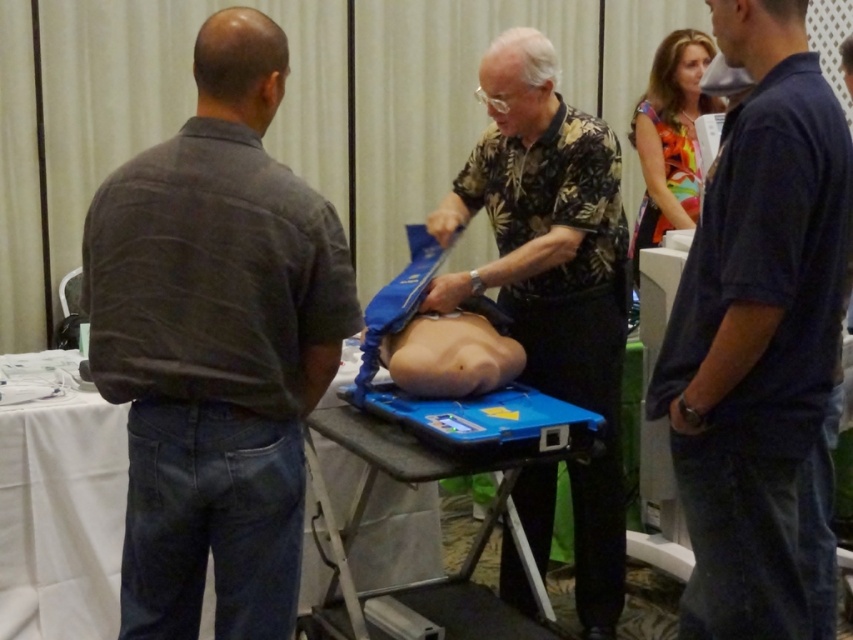
Question: Can you confirm if dark gray shirt at left is smaller than blue plastic table at center?

Choices:
 (A) no
 (B) yes

Answer: (B)

Question: Does dark blue shirt at right have a lesser width compared to smooth skin at center?

Choices:
 (A) no
 (B) yes

Answer: (B)

Question: Based on their relative distances, which object is nearer to the floral shirt at center?

Choices:
 (A) smooth skin at center
 (B) dark gray shirt at left
 (C) dark blue shirt at right
 (D) blue plastic table at center

Answer: (A)

Question: Where is dark gray shirt at left located in relation to smooth skin at center in the image?

Choices:
 (A) above
 (B) below

Answer: (A)

Question: Which object is farther from the camera taking this photo?

Choices:
 (A) dark gray shirt at left
 (B) blue plastic table at center

Answer: (B)

Question: Which point is closer to the camera?

Choices:
 (A) smooth skin at center
 (B) dark blue shirt at right
 (C) floral shirt at center
 (D) dark gray shirt at left

Answer: (B)